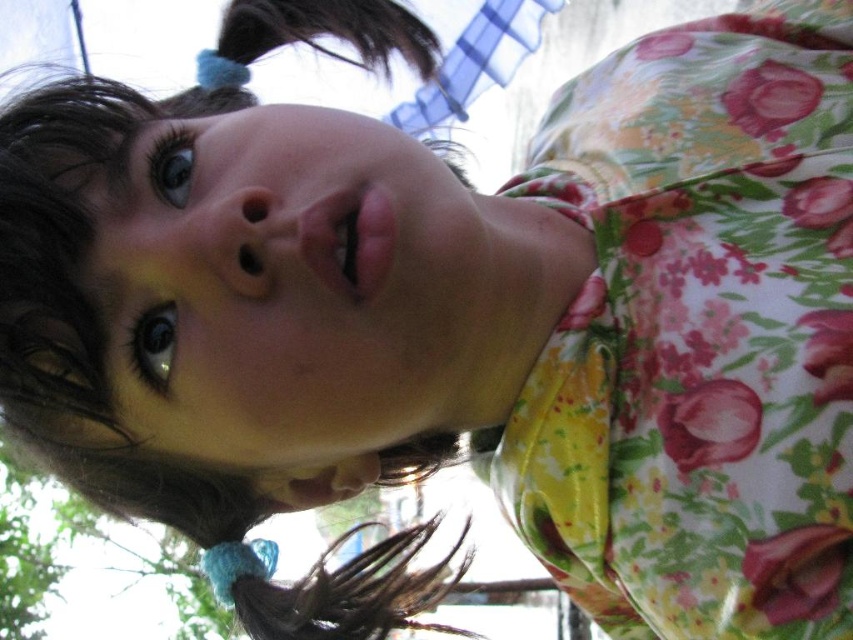
Does floral fabric dress at upper center lie in front of blue fabric hair at upper center?

Yes, floral fabric dress at upper center is in front of blue fabric hair at upper center.

From the picture: Which of these two, floral fabric dress at upper center or blue fabric hair at upper center, stands taller?

floral fabric dress at upper center is taller.

Describe the element at coordinates (697, 336) in the screenshot. Image resolution: width=853 pixels, height=640 pixels. I see `floral fabric dress at upper center` at that location.

This screenshot has height=640, width=853. What are the coordinates of `floral fabric dress at upper center` in the screenshot? It's located at (697, 336).